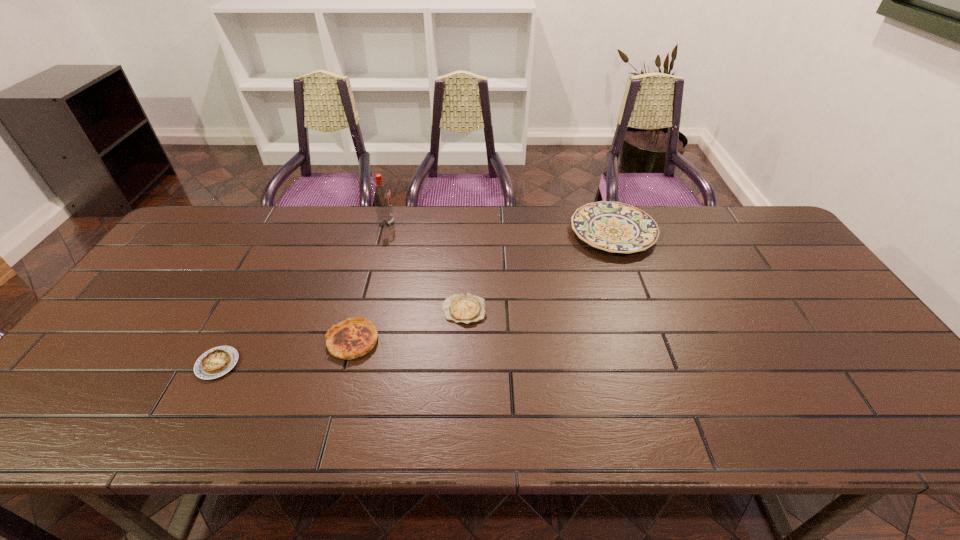
Find the location of a particular element. vacant space located 0.200m on the back of the second shortest quiche is located at coordinates (256, 291).

What are the coordinates of `free region located 0.260m on the right of the shortest object` in the screenshot? It's located at (583, 310).

In order to click on vodka at the far edge in this screenshot , I will do `click(381, 194)`.

Locate an element on the screen. The width and height of the screenshot is (960, 540). plate located at the far edge is located at coordinates (615, 227).

What are the coordinates of `vacant space at the far edge of the desktop` in the screenshot? It's located at tap(348, 212).

Where is `free spot at the left edge of the desktop`? free spot at the left edge of the desktop is located at coordinates (175, 268).

Locate an element on the screen. vacant space at the right edge is located at coordinates (776, 293).

The height and width of the screenshot is (540, 960). Identify the location of free region at the far left corner of the desktop. (212, 249).

The height and width of the screenshot is (540, 960). I want to click on vacant space at the far right corner of the desktop, so click(744, 226).

In the image, there is a desktop. Identify the location of vacant area at the near right corner. (931, 433).